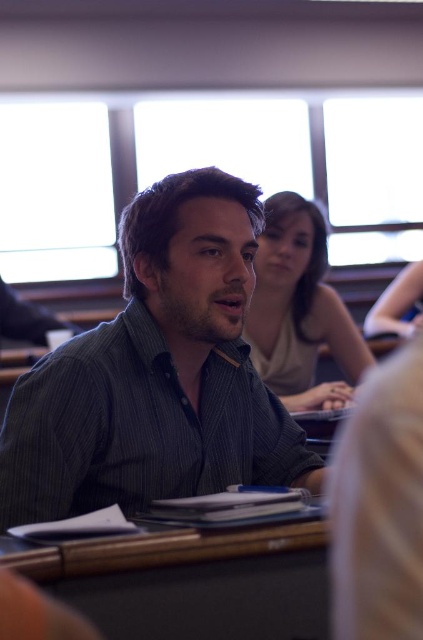
Question: Is dark green striped shirt at center closer to camera compared to matte gray shirt at center?

Choices:
 (A) no
 (B) yes

Answer: (B)

Question: Can you confirm if dark green striped shirt at center is positioned below matte gray shirt at center?

Choices:
 (A) no
 (B) yes

Answer: (B)

Question: Which object is positioned farthest from the black matte table at lower center?

Choices:
 (A) dark green striped shirt at center
 (B) matte gray shirt at center

Answer: (B)

Question: In this image, where is dark green striped shirt at center located relative to black matte table at lower center?

Choices:
 (A) below
 (B) above

Answer: (B)

Question: Which point is closer to the camera?

Choices:
 (A) dark green striped shirt at center
 (B) black matte table at lower center

Answer: (B)

Question: Which object is positioned closest to the dark green striped shirt at center?

Choices:
 (A) matte gray shirt at center
 (B) black matte table at lower center

Answer: (B)